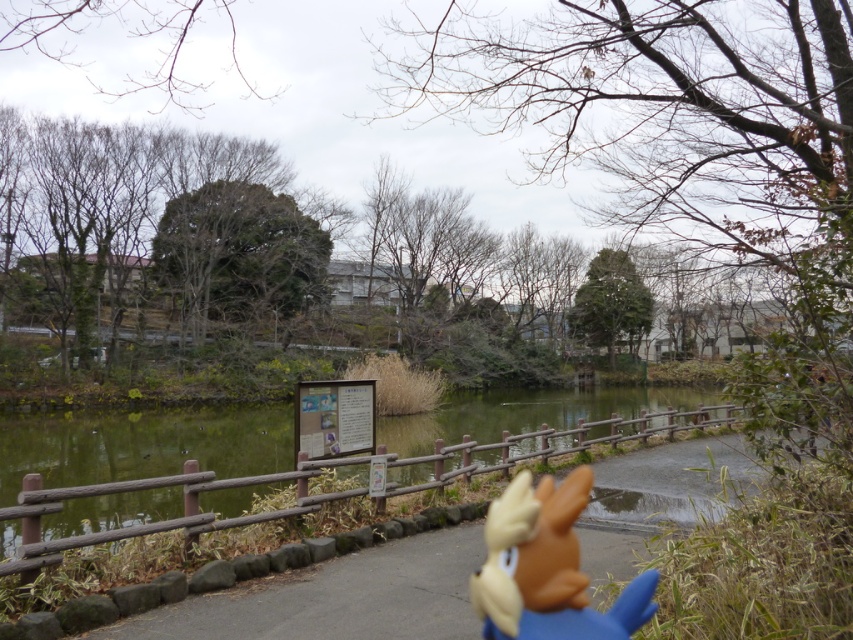
You are a GUI agent. You are given a task and a screenshot of the screen. Output one action in this format:
    pyautogui.click(x=<x>, y=<y>)
    Task: Click on the green wooden fence at center
    
    Given the screenshot: What is the action you would take?
    pyautogui.click(x=141, y=444)

Image resolution: width=853 pixels, height=640 pixels. I want to click on green wooden fence at center, so click(x=141, y=444).